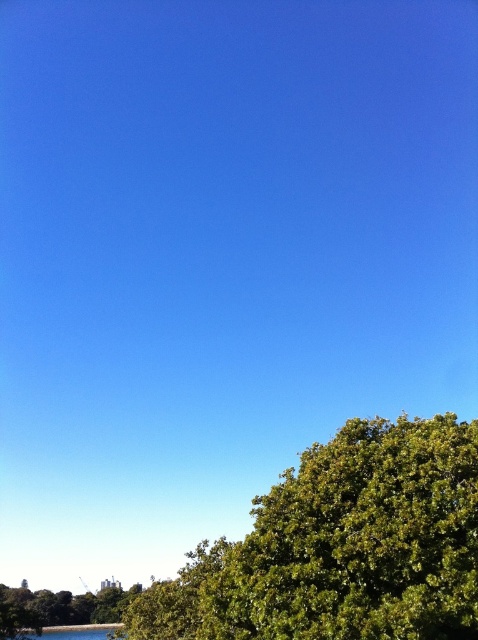
You are standing in the middle of the scene and want to take a photo of both the green leafy tree at lower right and the green leafy tree at lower left. Which tree should you focus on first if you want to include both in the frame without moving your camera?

You should focus on the green leafy tree at lower left first because it is taller than the green leafy tree at lower right, so it will occupy more space in the frame and ensure both are visible.